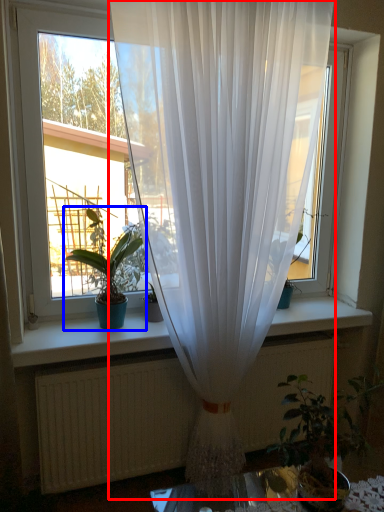
Question: Which object is closer to the camera taking this photo, curtain (highlighted by a red box) or houseplant (highlighted by a blue box)?

Choices:
 (A) curtain
 (B) houseplant

Answer: (A)